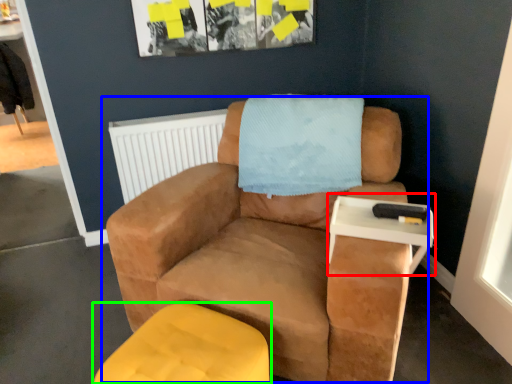
Question: Considering the real-world distances, which object is closest to table (highlighted by a red box)? chair (highlighted by a blue box) or furniture (highlighted by a green box).

Choices:
 (A) chair
 (B) furniture

Answer: (A)